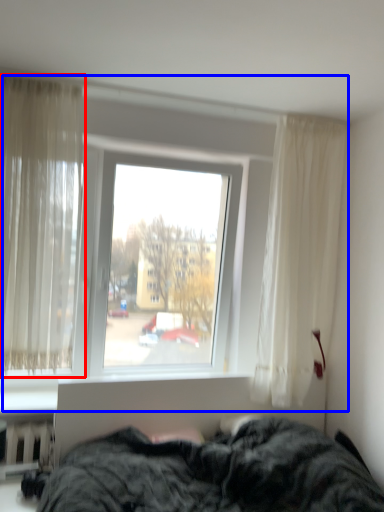
Question: Which of the following is the farthest to the observer, curtain (highlighted by a red box) or window (highlighted by a blue box)?

Choices:
 (A) curtain
 (B) window

Answer: (B)